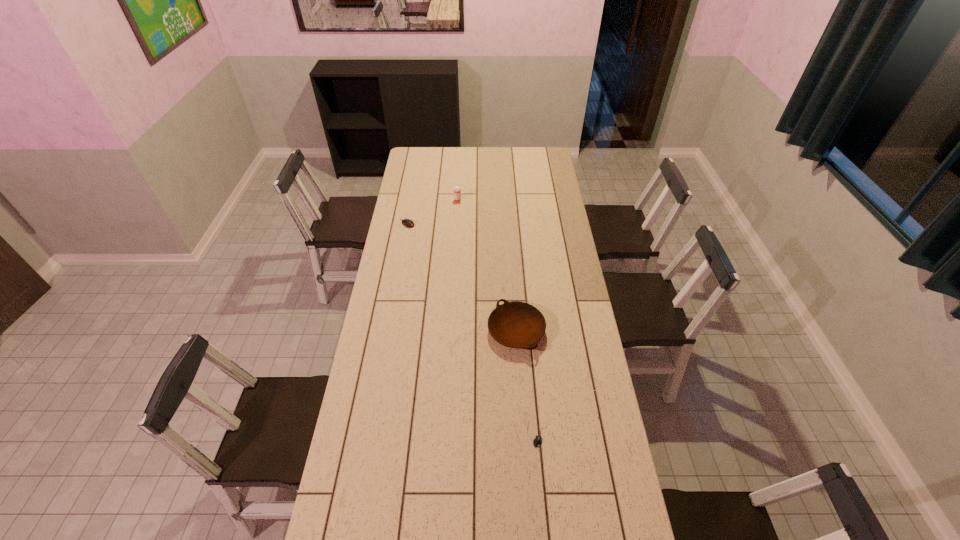
This screenshot has height=540, width=960. What are the coordinates of `vacant point located between the third nearest object and the nearer mouse` in the screenshot? It's located at click(x=474, y=330).

Image resolution: width=960 pixels, height=540 pixels. In order to click on vacant point located between the third object from right to left and the second tallest object in this screenshot , I will do `click(487, 266)`.

You are a GUI agent. You are given a task and a screenshot of the screen. Output one action in this format:
    pyautogui.click(x=<x>, y=<y>)
    Task: Click on the vacant space in between the third shortest object and the shorter mouse
    The image size is (960, 540).
    Given the screenshot: What is the action you would take?
    pyautogui.click(x=528, y=383)

This screenshot has height=540, width=960. Find the location of `free space between the plate and the right mouse`. free space between the plate and the right mouse is located at coordinates (528, 383).

Where is `object identified as the closest to the third shortest object`? object identified as the closest to the third shortest object is located at coordinates (537, 441).

Point out which object is positioned as the second nearest to the second object from left to right. Please provide its 2D coordinates. Your answer should be formatted as a tuple, i.e. [(x, y)], where the tuple contains the x and y coordinates of a point satisfying the conditions above.

[(516, 324)]

Identify the location of free space that satisfies the following two spatial constraints: 1. on the front side of the plate; 2. on the right side of the shorter mouse. This screenshot has width=960, height=540. (523, 436).

Where is `free space in the image that satisfies the following two spatial constraints: 1. on the front side of the farthest object; 2. on the right side of the plate`? Image resolution: width=960 pixels, height=540 pixels. free space in the image that satisfies the following two spatial constraints: 1. on the front side of the farthest object; 2. on the right side of the plate is located at coordinates (450, 331).

The height and width of the screenshot is (540, 960). In order to click on vacant position in the image that satisfies the following two spatial constraints: 1. on the front side of the plate; 2. on the left side of the farther mouse in this screenshot , I will do click(388, 331).